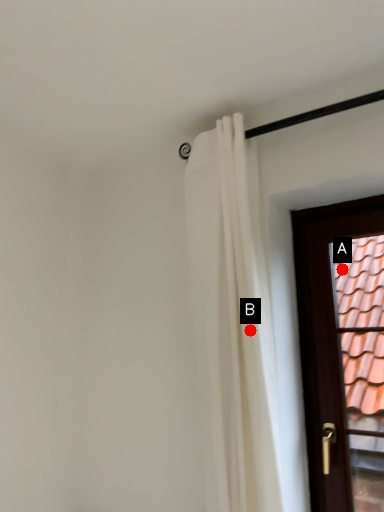
Question: Two points are circled on the image, labeled by A and B beside each circle. Which point is further to the camera?

Choices:
 (A) A is further
 (B) B is further

Answer: (A)